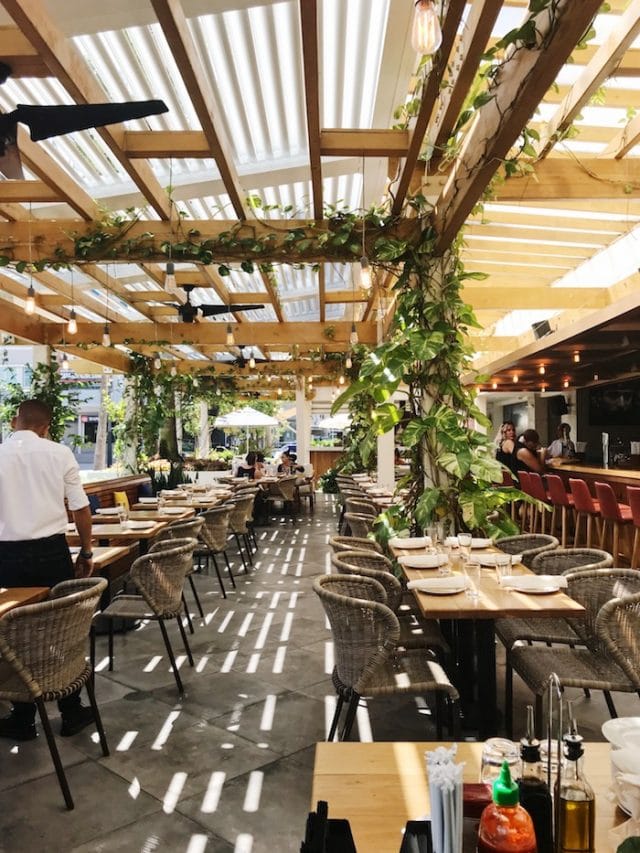
The image size is (640, 853). I want to click on plate, so click(445, 584).